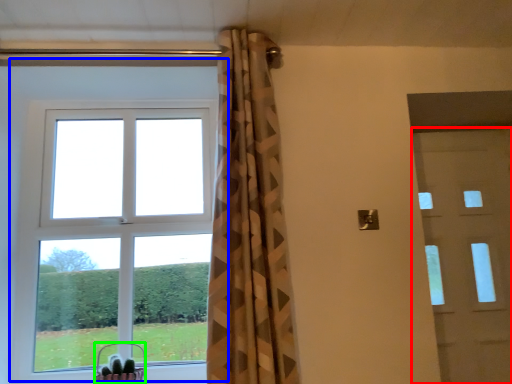
Question: Which is farther away from door (highlighted by a red box)? window (highlighted by a blue box) or basket (highlighted by a green box)?

Choices:
 (A) window
 (B) basket

Answer: (B)